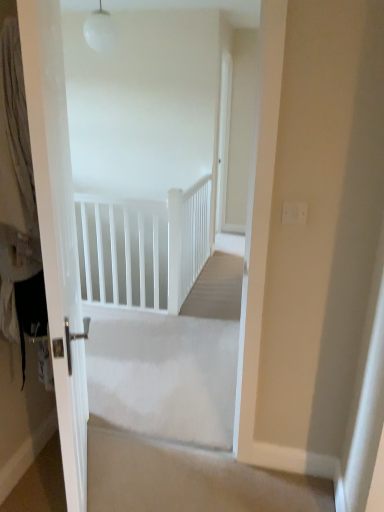
The image size is (384, 512). Describe the element at coordinates (51, 159) in the screenshot. I see `white glossy door at left` at that location.

I want to click on white fabric curtain at left, so click(19, 195).

Considering the positions of objects white matte rail at upper center and beige carpet at center in the image provided, who is behind, white matte rail at upper center or beige carpet at center?

white matte rail at upper center is behind.

From the image's perspective, which object appears higher, white matte rail at upper center or beige carpet at center?

white matte rail at upper center appears higher in the image.

Is white matte rail at upper center at the left side of beige carpet at center?

Yes, white matte rail at upper center is to the left of beige carpet at center.

Which is more to the right, white glossy door at left or white fabric curtain at left?

white glossy door at left is more to the right.

Looking at the image, does white glossy door at left seem bigger or smaller compared to white fabric curtain at left?

white glossy door at left is bigger than white fabric curtain at left.

How different are the orientations of white glossy door at left and white fabric curtain at left in degrees?

The angle between the facing direction of white glossy door at left and the facing direction of white fabric curtain at left is 180 degrees.

From the image's perspective, is white glossy door at left under white fabric curtain at left?

Indeed, from the image's perspective, white glossy door at left is shown beneath white fabric curtain at left.

Who is smaller, white matte rail at upper center or white glossy door at left?

white matte rail at upper center.

Find the location of a particular element. This screenshot has height=512, width=384. door above the white matte rail at upper center (from a real-world perspective) is located at coordinates (51, 159).

Considering the positions of objects white matte rail at upper center and white glossy door at left in the image provided, who is in front, white matte rail at upper center or white glossy door at left?

white glossy door at left is more forward.

Is white fabric curtain at left positioned far away from beige carpet at center?

Absolutely, white fabric curtain at left is distant from beige carpet at center.

Does white fabric curtain at left have a lesser width compared to beige carpet at center?

Correct, the width of white fabric curtain at left is less than that of beige carpet at center.

Can beige carpet at center be found inside white fabric curtain at left?

That's incorrect, beige carpet at center is not inside white fabric curtain at left.

Could you tell me if beige carpet at center is turned towards white matte rail at upper center?

No, beige carpet at center is not turned towards white matte rail at upper center.

Which object is closer to the camera, beige carpet at center or white matte rail at upper center?

beige carpet at center is in front.

From a real-world perspective, is beige carpet at center positioned over white matte rail at upper center based on gravity?

No, from a real-world perspective, beige carpet at center is not above white matte rail at upper center.

Is beige carpet at center inside the boundaries of white matte rail at upper center, or outside?

beige carpet at center is outside white matte rail at upper center.

Who is taller, white fabric curtain at left or white matte rail at upper center?

With more height is white fabric curtain at left.

Is white fabric curtain at left facing away from white matte rail at upper center?

No.

Which is closer, (32, 254) or (176, 298)?

Point (32, 254).

Can you tell me how much white glossy door at left and beige carpet at center differ in facing direction?

The angular difference between white glossy door at left and beige carpet at center is 67 degrees.

From a real-world perspective, is white glossy door at left physically located above or below beige carpet at center?

Clearly, from a real-world perspective, white glossy door at left is above beige carpet at center.

Does white glossy door at left turn towards beige carpet at center?

Yes, white glossy door at left is turned towards beige carpet at center.

Can you confirm if white glossy door at left is positioned to the right of beige carpet at center?

No, white glossy door at left is not to the right of beige carpet at center.

Where is `stairwell that is below the white matte rail at upper center (from the image's perspective)`? stairwell that is below the white matte rail at upper center (from the image's perspective) is located at coordinates (188, 478).

This screenshot has height=512, width=384. What are the coordinates of `curtain behind the white glossy door at left` in the screenshot? It's located at (19, 195).

Estimate the real-world distances between objects in this image. Which object is closer to white fabric curtain at left, white matte rail at upper center or white glossy door at left?

white glossy door at left is closer to white fabric curtain at left.

Which object lies further to the anchor point white matte rail at upper center, beige carpet at center or white fabric curtain at left?

white fabric curtain at left lies further to white matte rail at upper center than the other object.

Based on the photo, based on their spatial positions, is beige carpet at center or white glossy door at left further from white matte rail at upper center?

beige carpet at center is further to white matte rail at upper center.

Looking at the image, which one is located further to white glossy door at left, white fabric curtain at left or beige carpet at center?

beige carpet at center is positioned further to the anchor white glossy door at left.

Looking at the image, which one is located closer to beige carpet at center, white fabric curtain at left or white glossy door at left?

The object closer to beige carpet at center is white glossy door at left.

From the image, which object appears to be nearer to white fabric curtain at left, white glossy door at left or white matte rail at upper center?

Based on the image, white glossy door at left appears to be nearer to white fabric curtain at left.

Considering their positions, is white glossy door at left positioned further to white matte rail at upper center than beige carpet at center?

The object further to white matte rail at upper center is beige carpet at center.

Which object lies nearer to the anchor point white glossy door at left, white fabric curtain at left or white matte rail at upper center?

white fabric curtain at left is closer to white glossy door at left.

Image resolution: width=384 pixels, height=512 pixels. Identify the location of door that lies between white fabric curtain at left and beige carpet at center from top to bottom. (51, 159).

Find the location of a particular element. The height and width of the screenshot is (512, 384). stairwell between white glossy door at left and white matte rail at upper center from front to back is located at coordinates (188, 478).

Locate an element on the screen. The height and width of the screenshot is (512, 384). curtain between white glossy door at left and white matte rail at upper center along the z-axis is located at coordinates (19, 195).

This screenshot has width=384, height=512. Find the location of `stairwell located between white fabric curtain at left and white matte rail at upper center in the depth direction`. stairwell located between white fabric curtain at left and white matte rail at upper center in the depth direction is located at coordinates (188, 478).